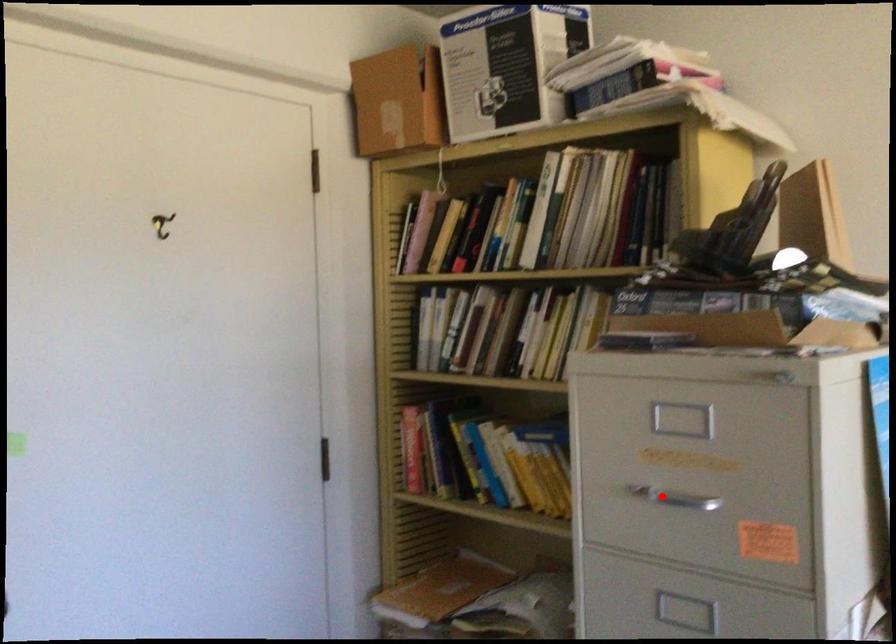
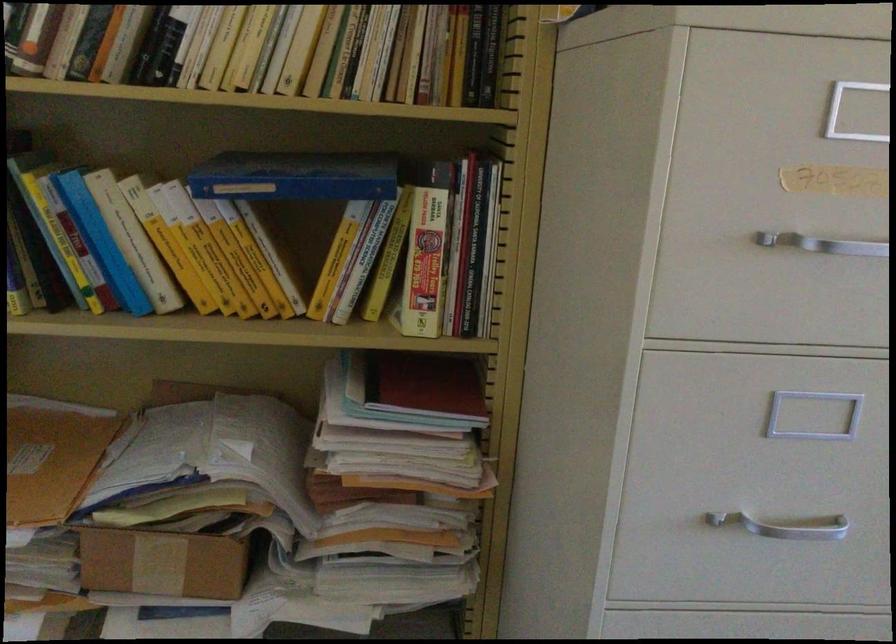
In the second image, find the point that corresponds to the highlighted location in the first image.

(823, 243)